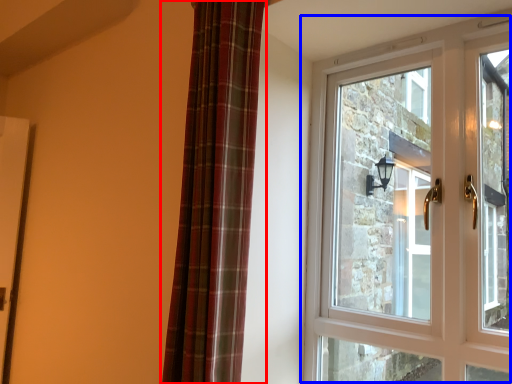
Question: Which of the following is the closest to the observer, curtain (highlighted by a red box) or window (highlighted by a blue box)?

Choices:
 (A) curtain
 (B) window

Answer: (A)